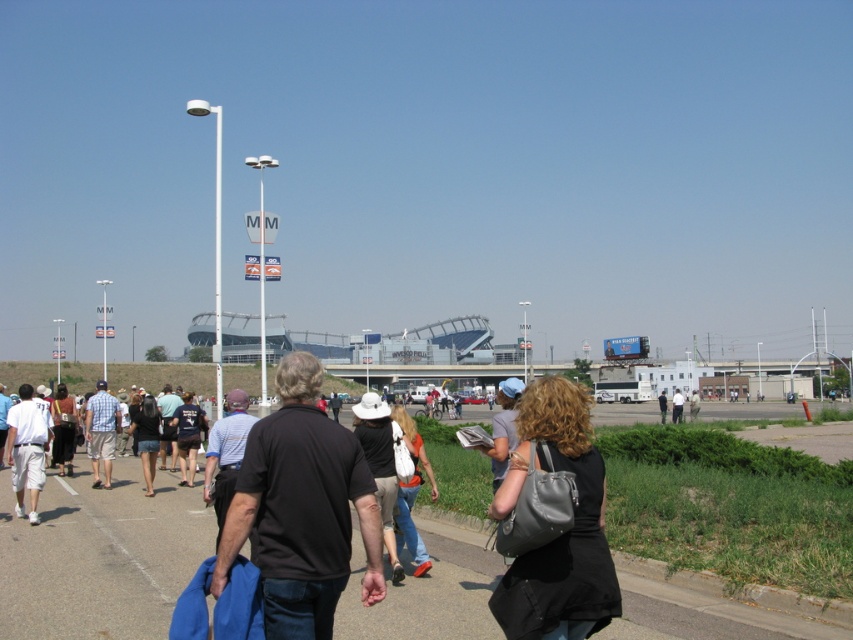
You are standing at the edge of the pathway and see the smooth asphalt tarmac at center and the black cotton shirt at center. Which object is positioned to the right?

The smooth asphalt tarmac at center is to the right of the black cotton shirt at center, so the smooth asphalt tarmac at center is positioned to the right.

You are standing on the smooth asphalt tarmac at center and looking down at the denim jeans at center. Which object is higher in elevation?

The smooth asphalt tarmac at center is higher in elevation than the denim jeans at center.

You are standing at the starting point and see the smooth asphalt tarmac at center and the black cotton shirt at center. Which object is farther from you?

The smooth asphalt tarmac at center is 10.14 meters away from the black cotton shirt at center, so the smooth asphalt tarmac at center is farther away from you than the black cotton shirt at center.